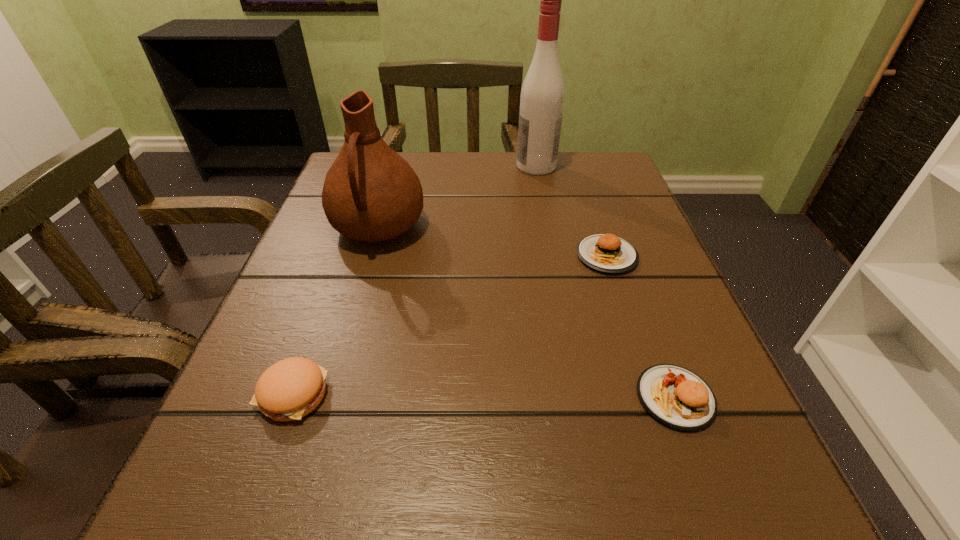
What are the coordinates of `the tallest object` in the screenshot? It's located at click(x=542, y=96).

Locate an element on the screen. This screenshot has height=540, width=960. alcohol is located at coordinates pyautogui.click(x=542, y=96).

At what (x,y) coordinates should I click in order to perform the action: click on the second tallest object. Please return your answer as a coordinate pair (x, y). Looking at the image, I should click on (371, 194).

At what (x,y) coordinates should I click in order to perform the action: click on the tallest food. Please return your answer as a coordinate pair (x, y). Image resolution: width=960 pixels, height=540 pixels. Looking at the image, I should click on (677, 397).

Where is `the leftmost food`? The height and width of the screenshot is (540, 960). the leftmost food is located at coordinates pos(290,389).

Locate an element on the screen. the farthest food is located at coordinates (607, 253).

Locate an element on the screen. This screenshot has height=540, width=960. vacant space located 0.310m on the label of the tallest object is located at coordinates (385, 166).

The height and width of the screenshot is (540, 960). What are the coordinates of `vacant area situated 0.110m on the label of the tallest object` in the screenshot? It's located at (469, 166).

Locate an element on the screen. The image size is (960, 540). vacant space located on the label of the tallest object is located at coordinates (441, 166).

At what (x,y) coordinates should I click in order to perform the action: click on vacant space located 0.390m on the side of the second tallest object with the handle. Please return your answer as a coordinate pair (x, y). Looking at the image, I should click on (304, 481).